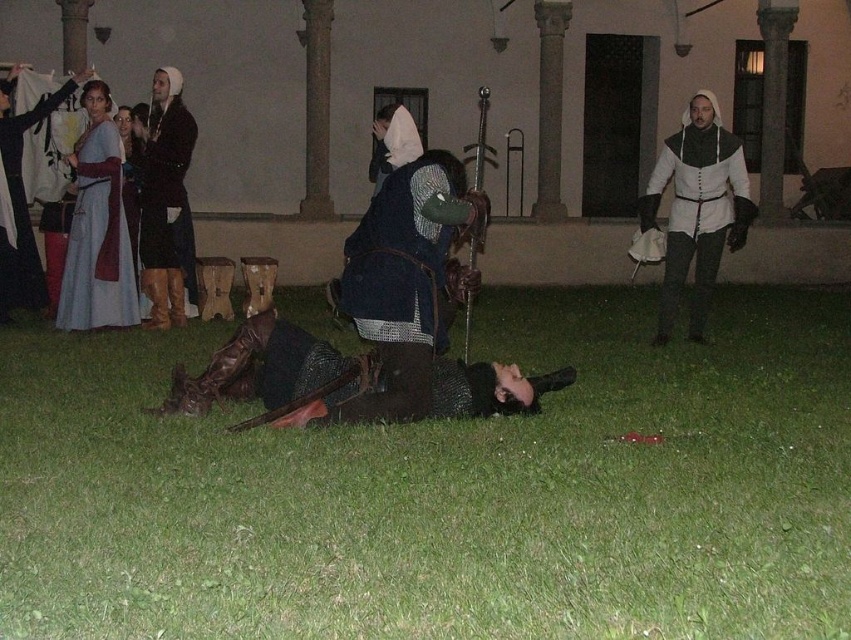
You are a costume designer preparing for a play. You have two costumes in the scene, the white matte armor at center and the matte black tunic at upper left. Which costume is larger in size?

The white matte armor at center is bigger than the matte black tunic at upper left.

You are a stage director observing the night scene of a historical reenactment. You need to place a spotlight exactly at point (406, 253). Which object should you focus the spotlight on?

The dark blue leather vest at center is located at point (406, 253), so you should focus the spotlight on the dark blue leather vest at center.

You are a stagehand in charge of setting up lights for the performance. You need to position a spotlight on the white matte armor at center and another on the matte black tunic at upper left. Based on their positions, which object should you light first if you want to follow the stage direction from left to right?

The matte black tunic at upper left should be lit first since it is positioned to the left of the white matte armor at center, following the left to right stage direction.